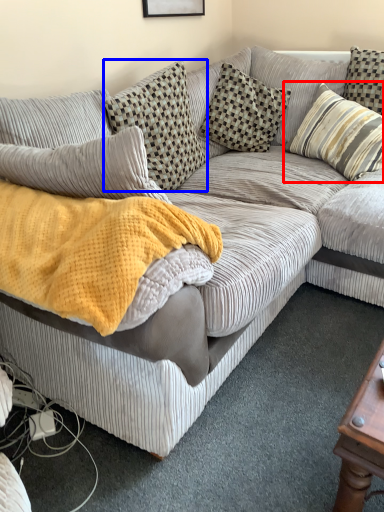
Question: Among these objects, which one is nearest to the camera, pillow (highlighted by a red box) or pillow (highlighted by a blue box)?

Choices:
 (A) pillow
 (B) pillow

Answer: (B)